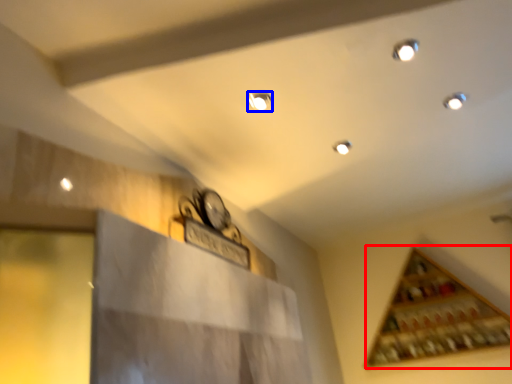
Question: Which object is further to the camera taking this photo, wine rack (highlighted by a red box) or light (highlighted by a blue box)?

Choices:
 (A) wine rack
 (B) light

Answer: (A)